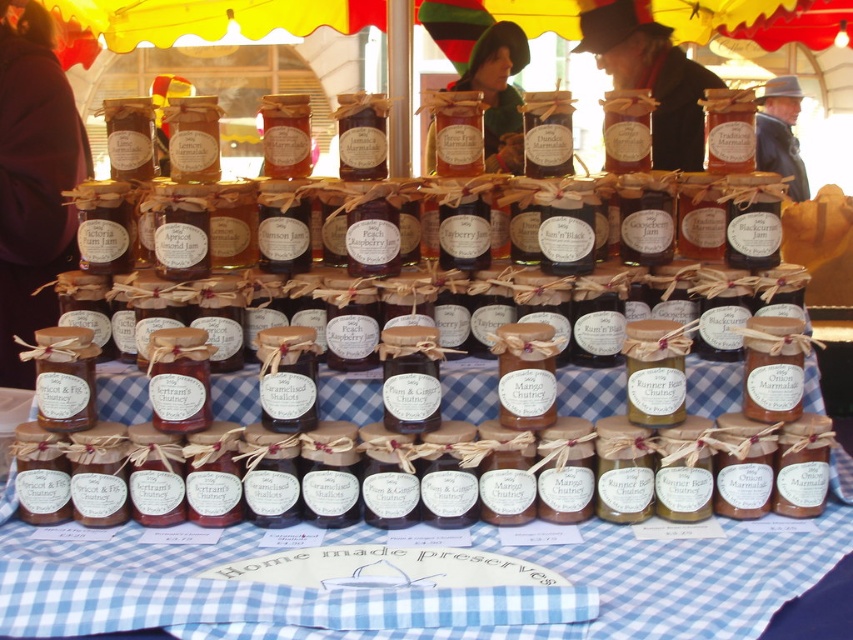
Between point (32, 372) and point (498, 51), which one is positioned in front?

Positioned in front is point (32, 372).

Based on the photo, can you confirm if dark brown wool coat at left is thinner than green felt hat at upper center?

Indeed, dark brown wool coat at left has a lesser width compared to green felt hat at upper center.

Who is more forward, [0,326] or [492,154]?

Positioned in front is point [0,326].

Where is `dark brown wool coat at left`? dark brown wool coat at left is located at coordinates (33, 179).

Which is above, blue checkered fabric at center or green felt hat at upper center?

green felt hat at upper center is higher up.

Is blue checkered fabric at center positioned at the back of green felt hat at upper center?

That is False.

This screenshot has height=640, width=853. I want to click on blue checkered fabric at center, so click(x=422, y=589).

Between point (357, 417) and point (51, 61), which one is positioned behind?

The point (51, 61) is more distant.

Can you confirm if blue checkered fabric at center is thinner than dark brown wool coat at left?

No, blue checkered fabric at center is not thinner than dark brown wool coat at left.

Between point (167, 624) and point (27, 384), which one is positioned behind?

The point (27, 384) is more distant.

Find the location of a particular element. blue checkered fabric at center is located at coordinates (422, 589).